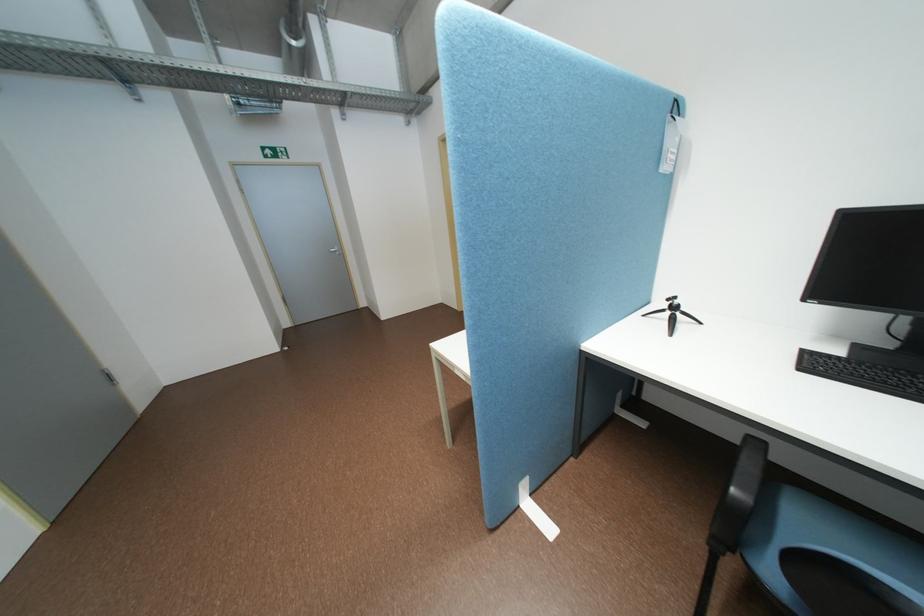
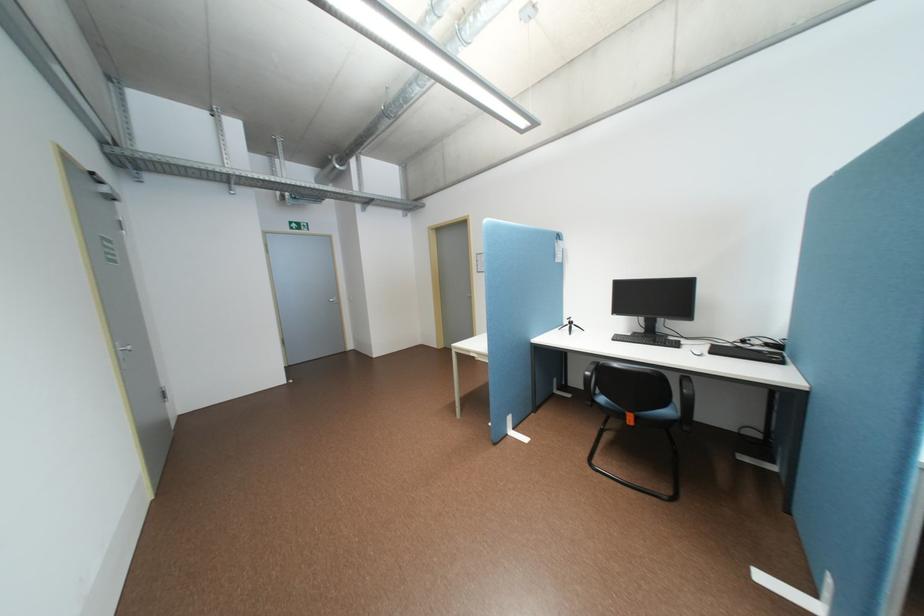
The point at [684,318] is marked in the first image. Where is the corresponding point in the second image?

(581, 328)